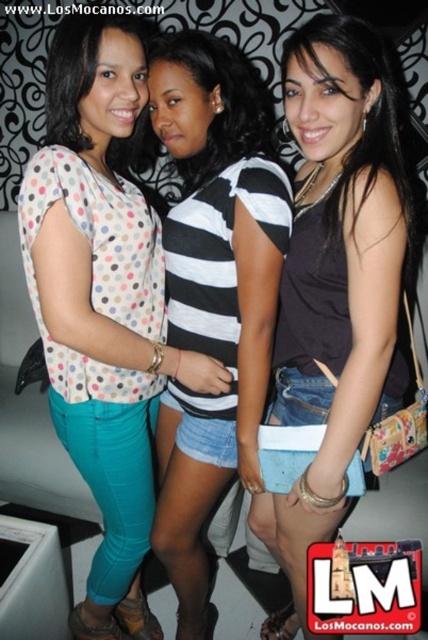
Question: Is polka dot fabric blouse at center positioned before dark brown leather tank top at center?

Choices:
 (A) no
 (B) yes

Answer: (A)

Question: Based on their relative distances, which object is nearer to the dark brown leather tank top at center?

Choices:
 (A) striped jersey at center
 (B) polka dot fabric blouse at center

Answer: (A)

Question: Which object is farther from the camera taking this photo?

Choices:
 (A) polka dot fabric blouse at center
 (B) striped jersey at center
 (C) dark brown leather tank top at center

Answer: (B)

Question: From the image, what is the correct spatial relationship of polka dot fabric blouse at center in relation to dark brown leather tank top at center?

Choices:
 (A) above
 (B) below

Answer: (B)

Question: Estimate the real-world distances between objects in this image. Which object is closer to the striped jersey at center?

Choices:
 (A) polka dot fabric blouse at center
 (B) dark brown leather tank top at center

Answer: (A)

Question: Is polka dot fabric blouse at center in front of striped jersey at center?

Choices:
 (A) no
 (B) yes

Answer: (B)